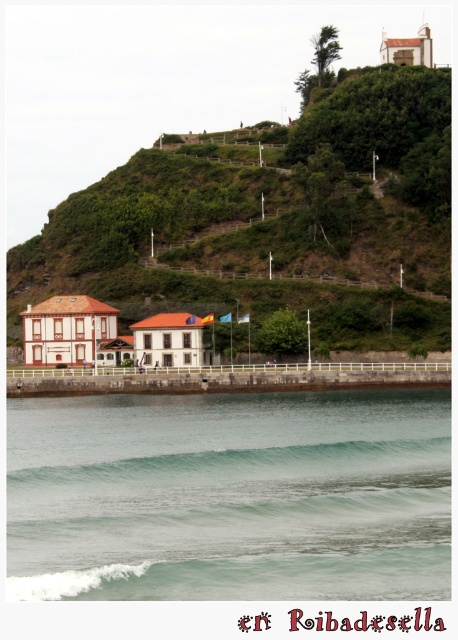
You are a photographer trying to capture the entire scene in one shot. Given that your camera can only focus on objects within a 10 meter width, can you fit both the green grassy hillside at upper center and the green translucent wave at lower center in the frame without cropping?

The green grassy hillside at upper center might be wider than green translucent wave at lower center, so it depends on their exact widths. If the combined width of both objects is under 10 meters, they can fit. However, if the hillside alone exceeds 10 meters, it won

You are standing on the shore looking out at the coastal scene. Which object is positioned lower in the image, the clear water at lower center or the green grassy hillside at upper center?

The clear water at lower center is positioned below the green grassy hillside at upper center, so it is the lower one.

You are standing at the coastal scene and want to determine the relative positions of two points marked in the image. Which point is closer to you, point (76, 442) or point (367, 456)?

Point (76, 442) is closer to you than point (367, 456) because it is further to the viewer according to the description.